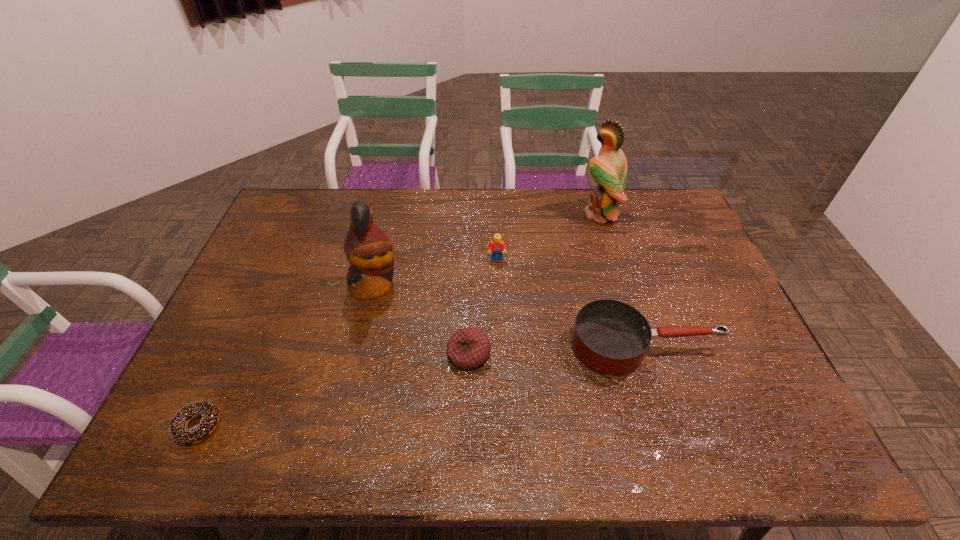
Identify the location of vacant area that lies between the right parrot and the fourth shortest object. (548, 237).

You are a GUI agent. You are given a task and a screenshot of the screen. Output one action in this format:
    pyautogui.click(x=<x>, y=<y>)
    Task: Click on the free area in between the right parrot and the third farthest object
    
    Given the screenshot: What is the action you would take?
    [487, 249]

This screenshot has height=540, width=960. What are the coordinates of `unoccupied position between the beanbag and the fifth object from right to left` in the screenshot? It's located at (421, 320).

At what (x,y) coordinates should I click in order to perform the action: click on vacant space that is in between the left parrot and the nearest object. Please return your answer as a coordinate pair (x, y). The height and width of the screenshot is (540, 960). Looking at the image, I should click on (286, 356).

Where is `unoccupied position between the leftmost object and the left parrot`? This screenshot has height=540, width=960. unoccupied position between the leftmost object and the left parrot is located at coordinates coord(286,356).

Image resolution: width=960 pixels, height=540 pixels. I want to click on empty space that is in between the farthest object and the beanbag, so click(x=535, y=284).

The height and width of the screenshot is (540, 960). Find the location of `free spot between the Lego and the fourth nearest object`. free spot between the Lego and the fourth nearest object is located at coordinates (435, 272).

Select which object appears as the closest to the leftmost object. Please provide its 2D coordinates. Your answer should be formatted as a tuple, i.e. [(x, y)], where the tuple contains the x and y coordinates of a point satisfying the conditions above.

[(368, 249)]

This screenshot has width=960, height=540. Identify the location of the fourth closest object relative to the third farthest object. (611, 337).

Where is `free space that satisfies the following two spatial constraints: 1. on the front-facing side of the right parrot; 2. on the face of the second farthest object`? free space that satisfies the following two spatial constraints: 1. on the front-facing side of the right parrot; 2. on the face of the second farthest object is located at coordinates (613, 259).